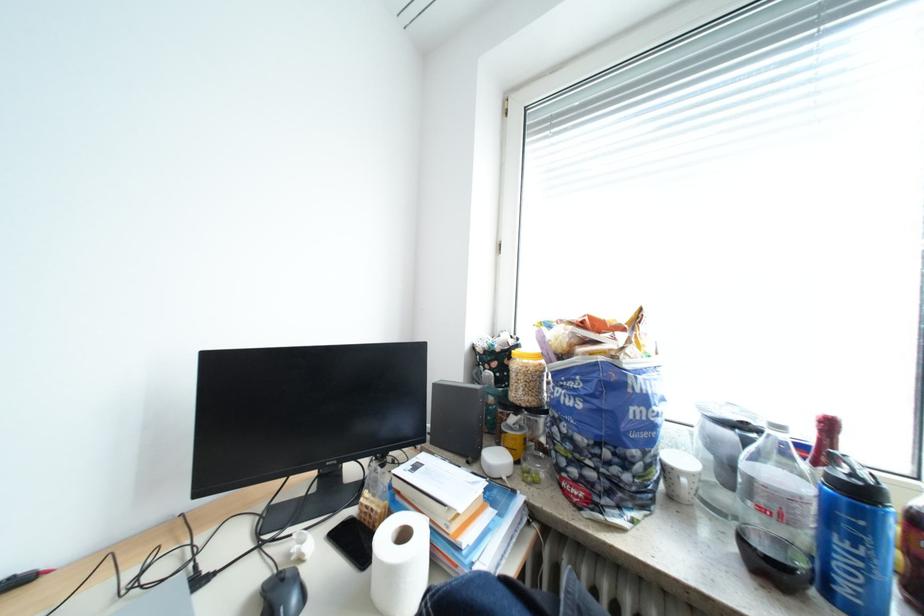
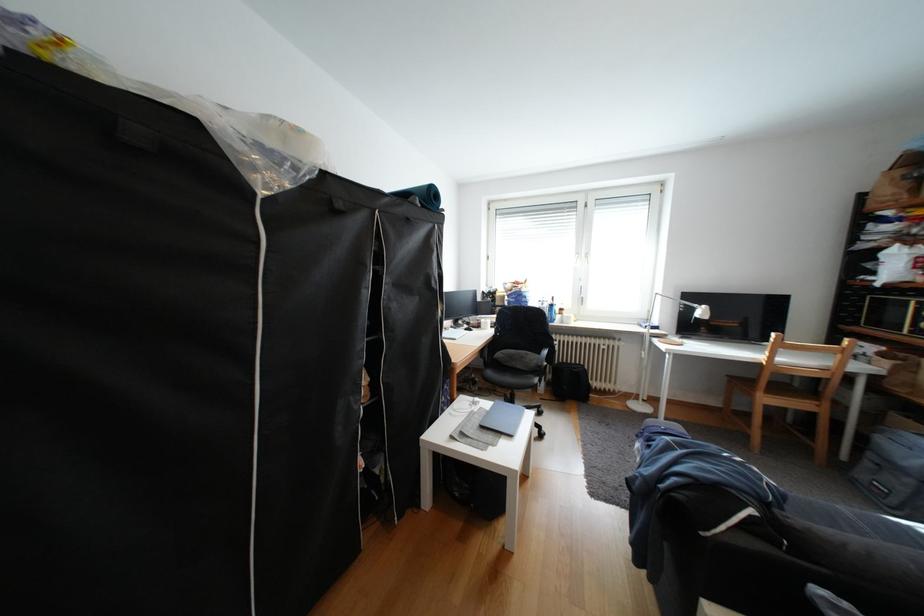
The images are taken continuously from a first-person perspective. In which direction are you moving?

The movement direction of the cameraman is left, backward.